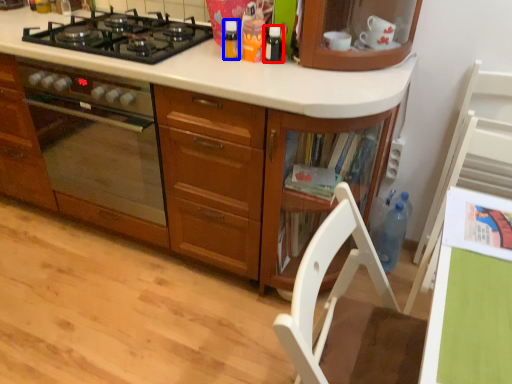
Question: Which of the following is the farthest to the observer, kitchen appliance (highlighted by a red box) or kitchen appliance (highlighted by a blue box)?

Choices:
 (A) kitchen appliance
 (B) kitchen appliance

Answer: (B)